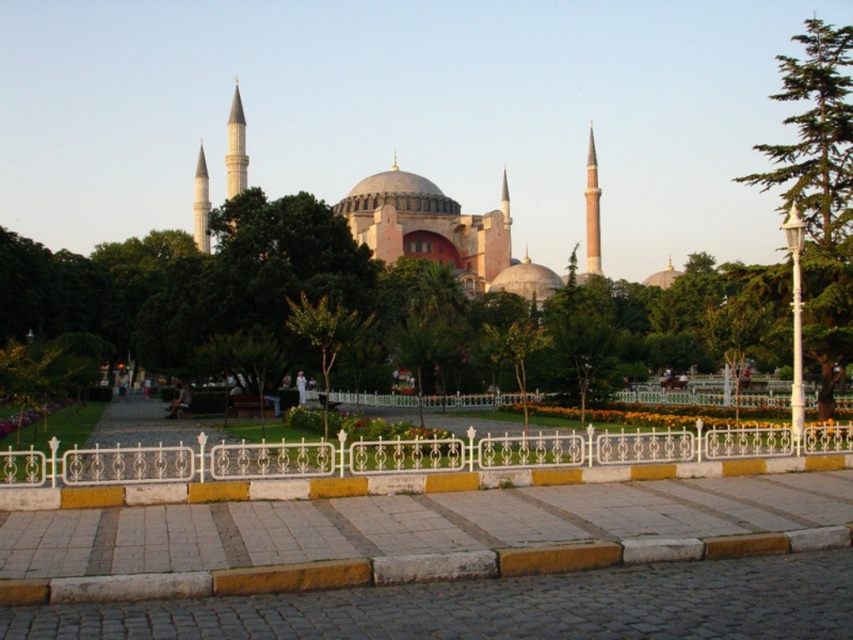
You are a visitor standing on the paved walkway in front of the mosque. You notice the white wrought iron fence at center and the green leafy tree at right. Which object is taller?

The green leafy tree at right is taller than the white wrought iron fence at center.

Based on the photo, you are planning to install a new bench in the park. The bench requires a space of 5 meters between the white wrought iron fence at center and the green leafy tree at right. Is there enough space for the bench between them?

The distance between the white wrought iron fence at center and the green leafy tree at right is 52.63 meters, which is more than enough to accommodate the bench requiring 5 meters of space.

You are standing at the entrance of the mosque and want to take a photo that includes both the point at coordinates point (242, 476) and point (746, 273). Since you want the closer point to be in focus, which point should you focus on?

You should focus on point (242, 476) because it is closer to the camera than point (746, 273).